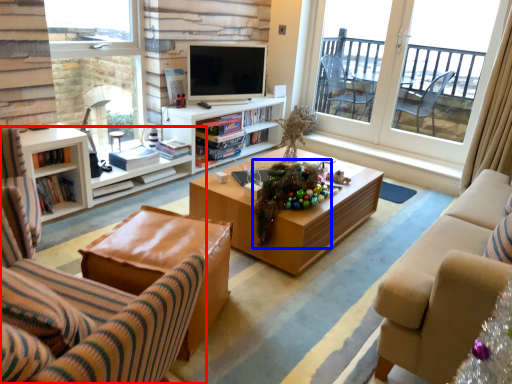
Question: Among these objects, which one is farthest to the camera, chair (highlighted by a red box) or christmas decoration (highlighted by a blue box)?

Choices:
 (A) chair
 (B) christmas decoration

Answer: (B)